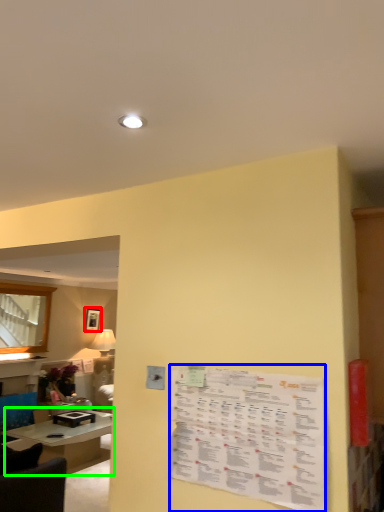
Question: Considering the real-world distances, which object is farthest from picture frame (highlighted by a red box)? menu (highlighted by a blue box) or table (highlighted by a green box)?

Choices:
 (A) menu
 (B) table

Answer: (A)